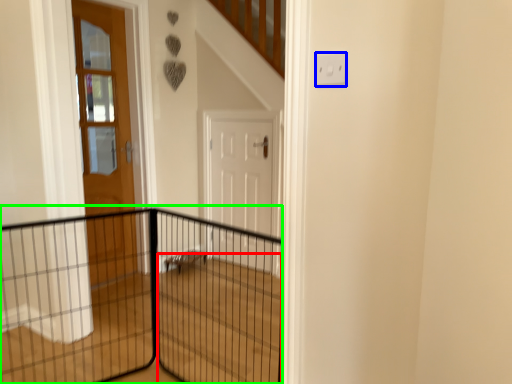
Question: Which object is the farthest from stairwell (highlighted by a red box)? Choose among these: electric outlet (highlighted by a blue box) or fence (highlighted by a green box).

Choices:
 (A) electric outlet
 (B) fence

Answer: (A)